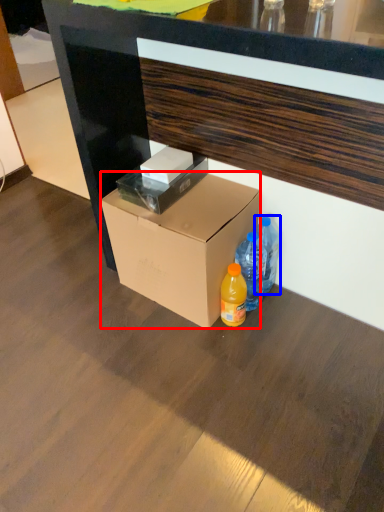
Question: Which point is further to the camera, box (highlighted by a red box) or bottle (highlighted by a blue box)?

Choices:
 (A) box
 (B) bottle

Answer: (B)